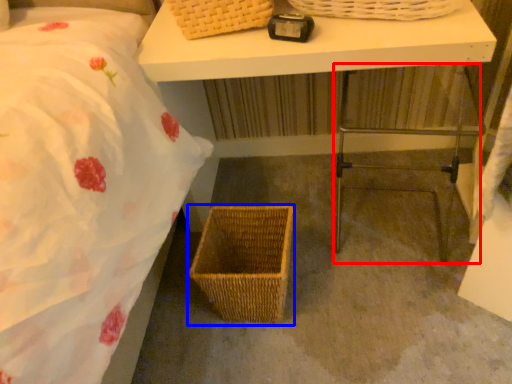
Question: Among these objects, which one is farthest to the camera, step stool (highlighted by a red box) or picnic basket (highlighted by a blue box)?

Choices:
 (A) step stool
 (B) picnic basket

Answer: (B)